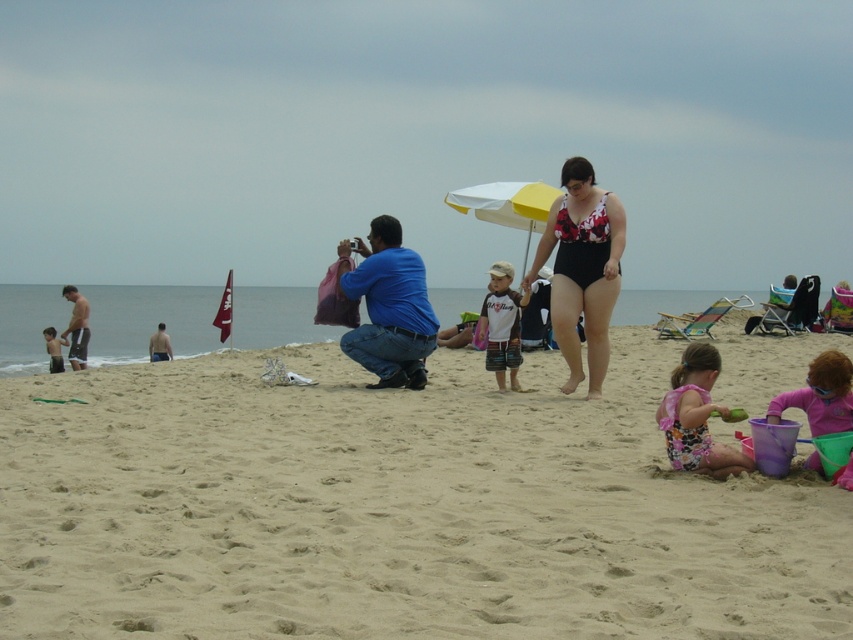
Does fine-grained sand at center come behind skinny white man at left?

That is False.

Who is higher up, fine-grained sand at center or skinny white man at left?

skinny white man at left

Is point (190, 486) farther from viewer compared to point (62, 332)?

No, it is not.

You are a GUI agent. You are given a task and a screenshot of the screen. Output one action in this format:
    pyautogui.click(x=<x>, y=<y>)
    Task: Click on the fine-grained sand at center
    The width and height of the screenshot is (853, 640).
    Given the screenshot: What is the action you would take?
    pyautogui.click(x=393, y=508)

Can you confirm if white cotton shirt at center is wider than matte black shirt at left?

No.

This screenshot has width=853, height=640. I want to click on white cotton shirt at center, so click(502, 324).

Is black swimsuit at center wider than pink rubber boots at lower right?

Incorrect, black swimsuit at center's width does not surpass pink rubber boots at lower right's.

Who is shorter, black swimsuit at center or pink rubber boots at lower right?

With less height is black swimsuit at center.

What do you see at coordinates (582, 269) in the screenshot?
I see `black swimsuit at center` at bounding box center [582, 269].

You are a GUI agent. You are given a task and a screenshot of the screen. Output one action in this format:
    pyautogui.click(x=<x>, y=<y>)
    Task: Click on the black swimsuit at center
    This screenshot has height=640, width=853.
    Given the screenshot: What is the action you would take?
    pyautogui.click(x=582, y=269)